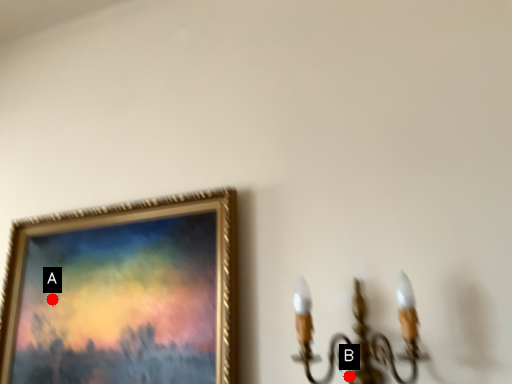
Question: Two points are circled on the image, labeled by A and B beside each circle. Which of the following is the farthest from the observer?

Choices:
 (A) A is further
 (B) B is further

Answer: (A)